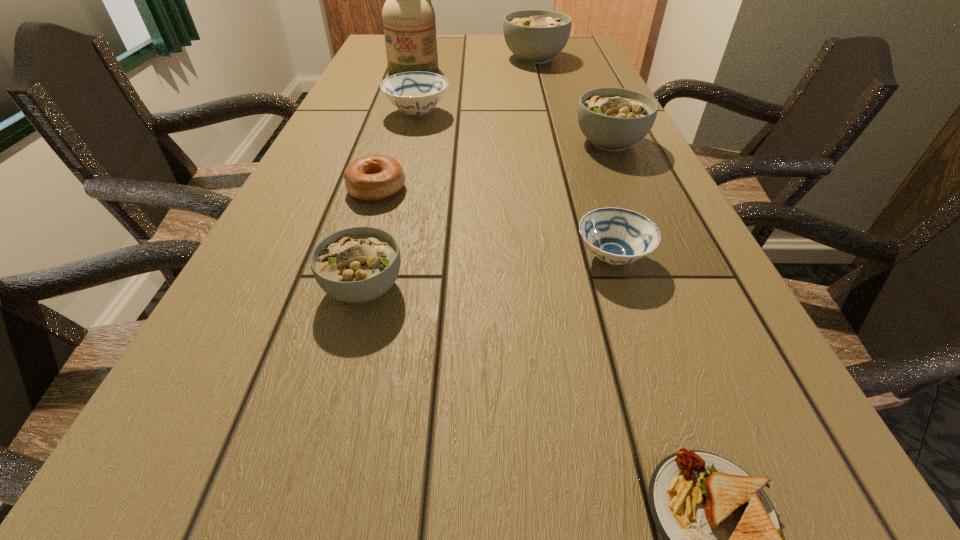
Identify the location of free spot between the tallest object and the biggest white soup bowl. The width and height of the screenshot is (960, 540). point(474,64).

Where is `free space that is in between the cleansing agent and the second biggest white soup bowl`? This screenshot has height=540, width=960. free space that is in between the cleansing agent and the second biggest white soup bowl is located at coordinates (512, 106).

This screenshot has height=540, width=960. Identify the location of free point between the nearest white soup bowl and the fourth shortest soup bowl. (487, 215).

The image size is (960, 540). I want to click on empty space between the cleansing agent and the fourth nearest object, so click(396, 130).

Find the location of a particular element. Image resolution: width=960 pixels, height=540 pixels. object that stands as the fourth closest to the fourth nearest object is located at coordinates (613, 119).

Select which object appears as the closest to the sandwich. Please provide its 2D coordinates. Your answer should be formatted as a tuple, i.e. [(x, y)], where the tuple contains the x and y coordinates of a point satisfying the conditions above.

[(617, 236)]

Select which soup bowl is the fourth closest to the sandwich. Please provide its 2D coordinates. Your answer should be formatted as a tuple, i.e. [(x, y)], where the tuple contains the x and y coordinates of a point satisfying the conditions above.

[(416, 93)]

You are a GUI agent. You are given a task and a screenshot of the screen. Output one action in this format:
    pyautogui.click(x=<x>, y=<y>)
    Task: Click on the third closest soup bowl to the smaller blue soup bowl
    
    Given the screenshot: What is the action you would take?
    pyautogui.click(x=416, y=93)

This screenshot has width=960, height=540. What are the coordinates of `white soup bowl that stands as the third closest to the tallest object` in the screenshot? It's located at (355, 265).

The height and width of the screenshot is (540, 960). In order to click on white soup bowl that stands as the second closest to the right blue soup bowl in this screenshot , I will do `click(355, 265)`.